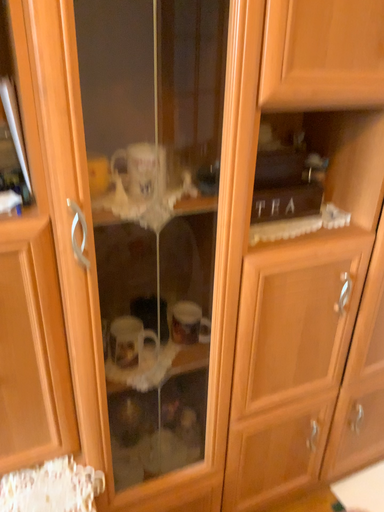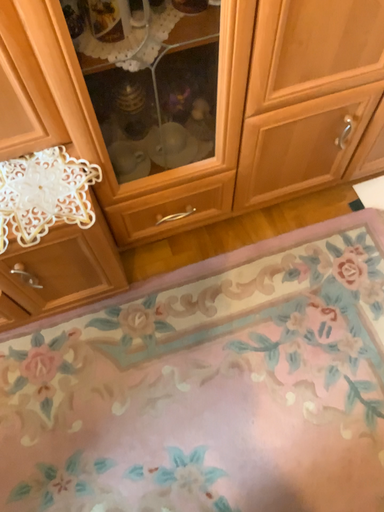
Question: Which way did the camera rotate in the video?

Choices:
 (A) rotated upward
 (B) rotated downward

Answer: (B)